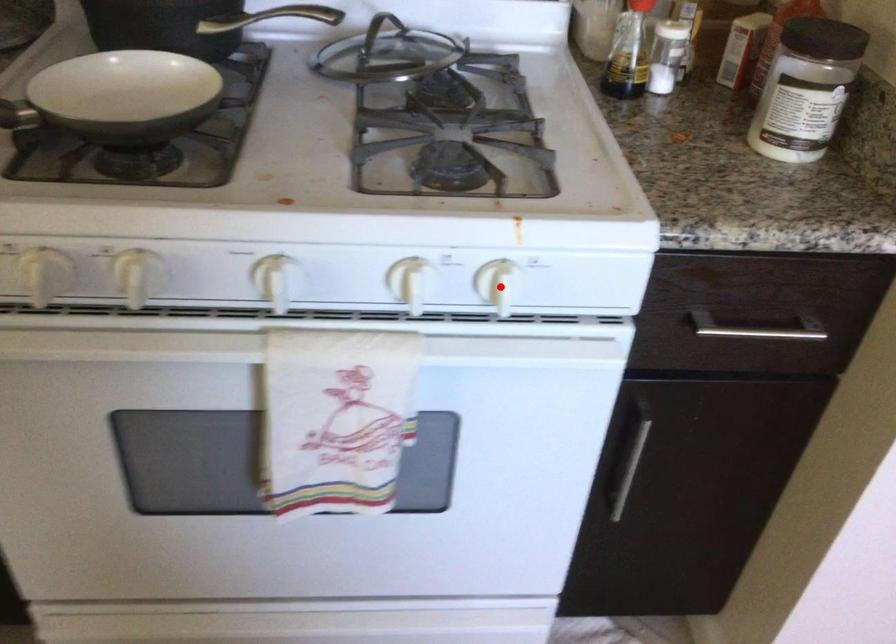
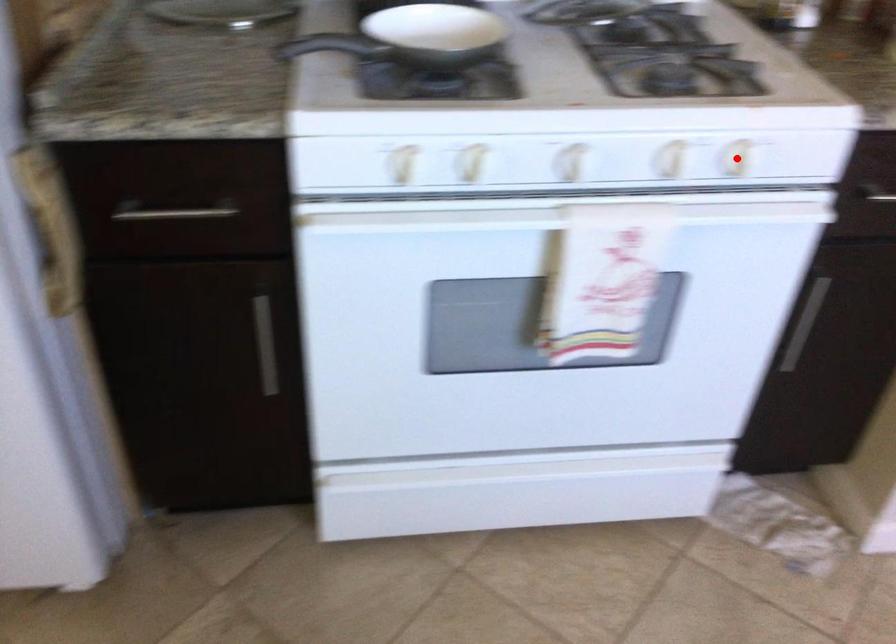
I am providing you with two images of the same scene from different viewpoints. A red point is marked on the first image and another point is marked on the second image. Do the highlighted points in image1 and image2 indicate the same real-world spot?

Yes